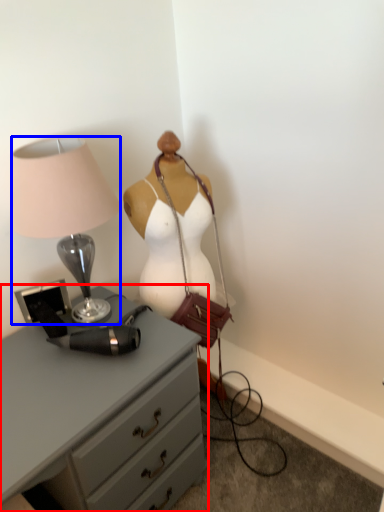
Question: Which of the following is the farthest to the observer, chest of drawers (highlighted by a red box) or lamp (highlighted by a blue box)?

Choices:
 (A) chest of drawers
 (B) lamp

Answer: (B)